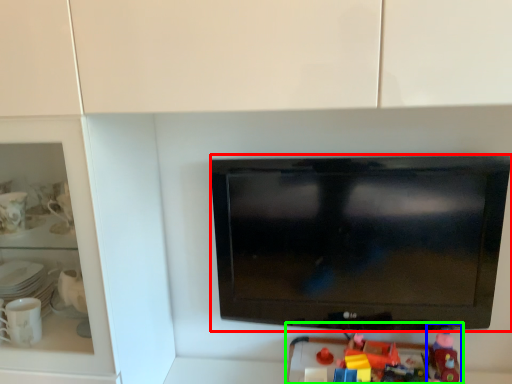
Question: Which object is the closest to the television (highlighted by a red box)? Choose among these: toy (highlighted by a blue box) or toy (highlighted by a green box).

Choices:
 (A) toy
 (B) toy

Answer: (B)